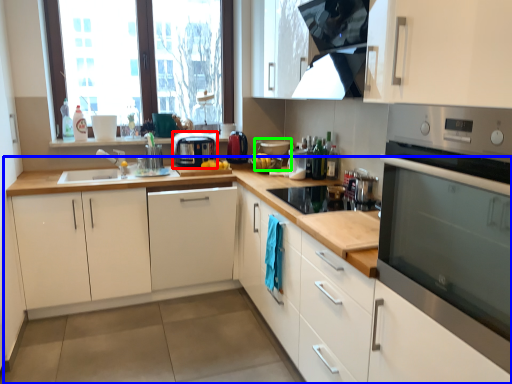
Question: Estimate the real-world distances between objects in this image. Which object is farther from kitchen appliance (highlighted by a red box), countertop (highlighted by a blue box) or appliance (highlighted by a green box)?

Choices:
 (A) countertop
 (B) appliance

Answer: (A)